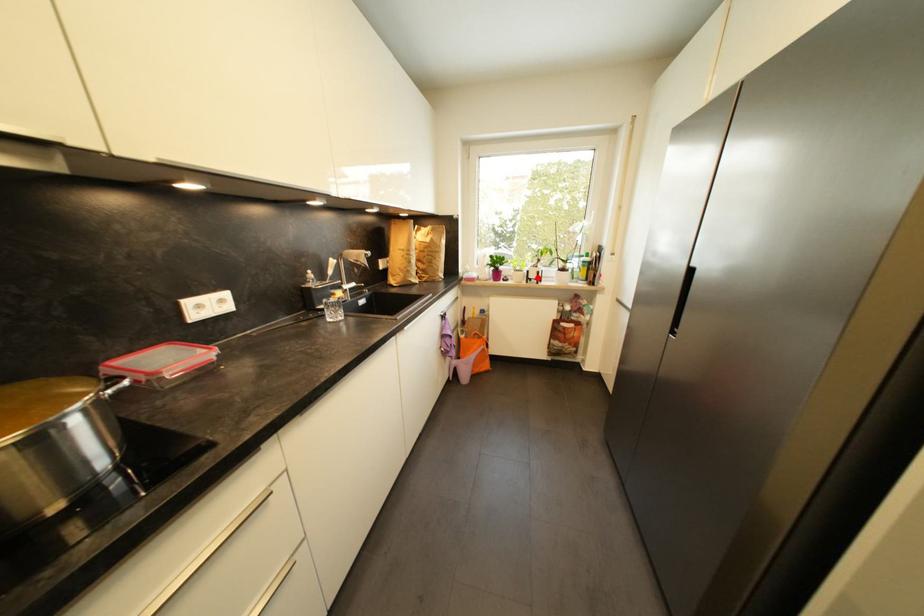
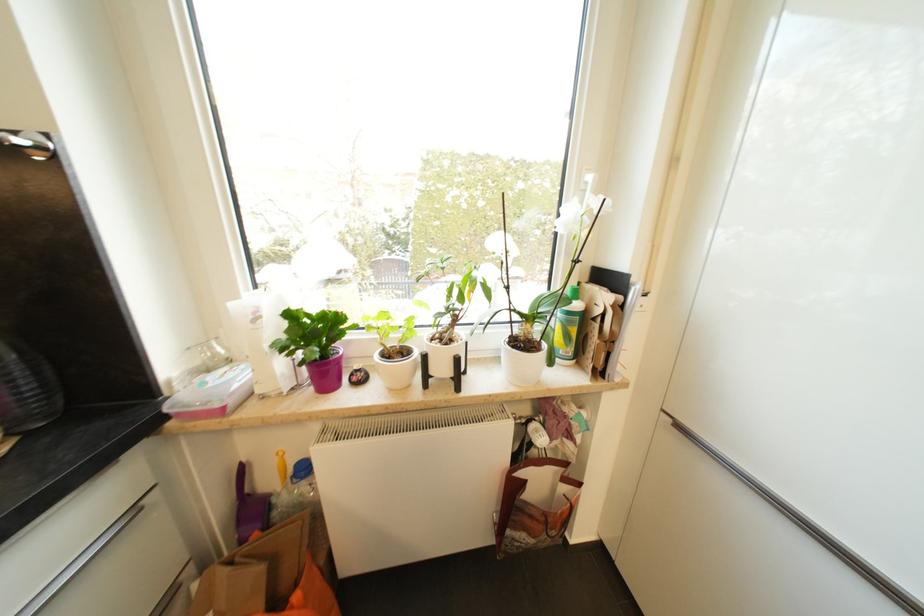
Where in the second image is the point corresponding to the highlighted location from the first image?

(446, 371)